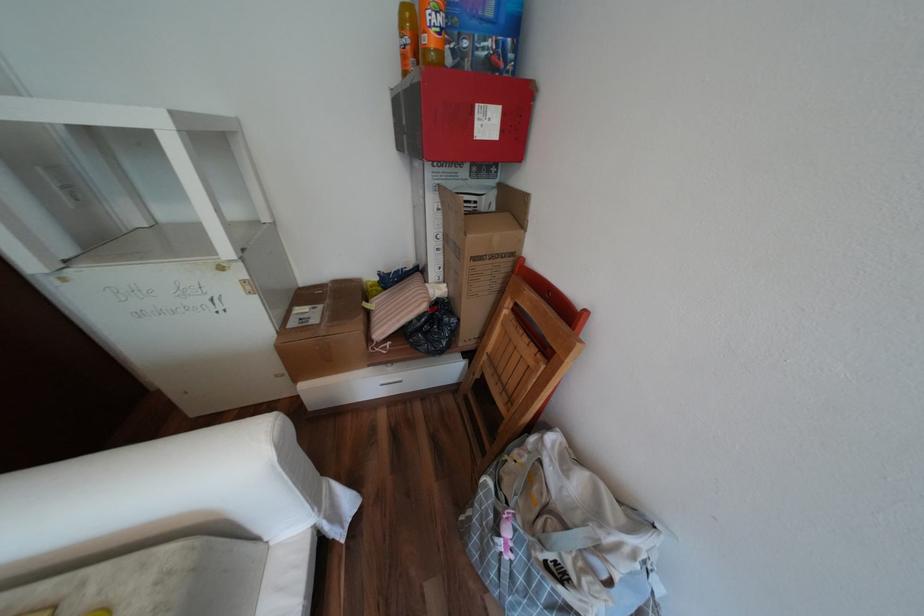
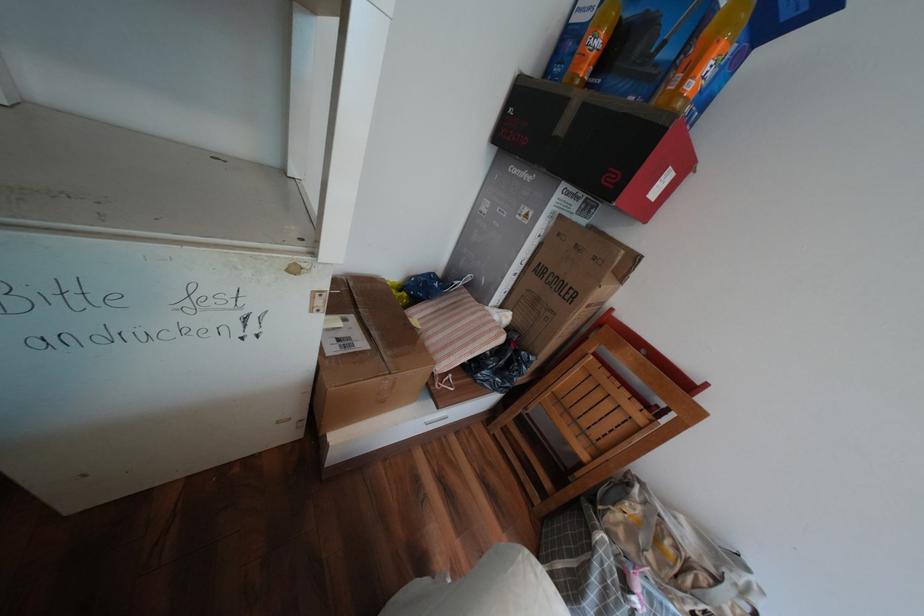
Question: The camera is either moving clockwise (left) or counter-clockwise (right) around the object. The first image is from the beginning of the video and the second image is from the end. Is the camera moving left or right when shooting the video?

Choices:
 (A) Left
 (B) Right

Answer: (A)